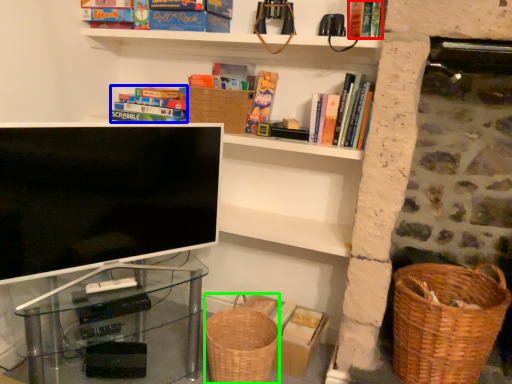
Question: Estimate the real-world distances between objects in this image. Which object is farther from book (highlighted by a red box), book (highlighted by a blue box) or basket container (highlighted by a green box)?

Choices:
 (A) book
 (B) basket container

Answer: (B)